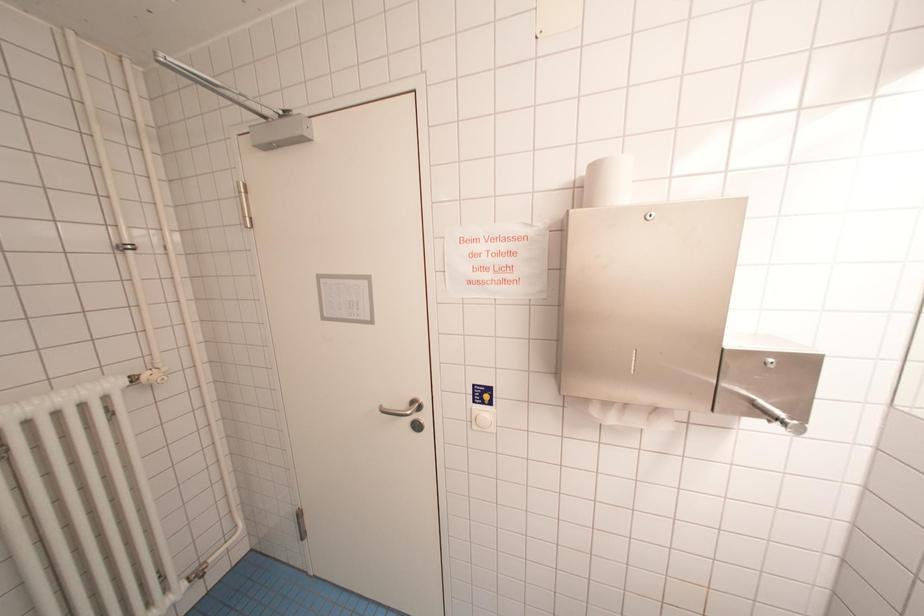
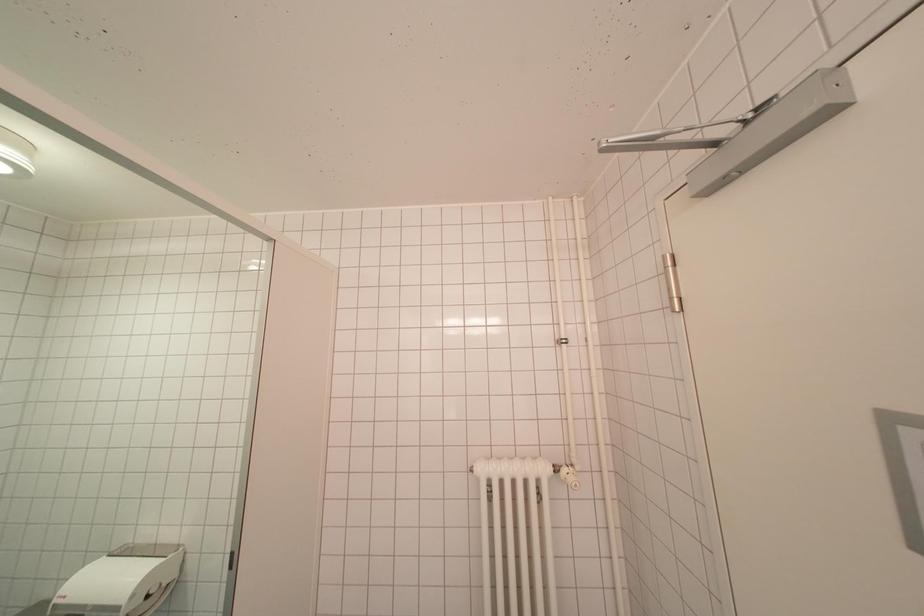
Question: The camera is either moving clockwise (left) or counter-clockwise (right) around the object. The first image is from the beginning of the video and the second image is from the end. Is the camera moving left or right when shooting the video?

Choices:
 (A) Left
 (B) Right

Answer: (B)